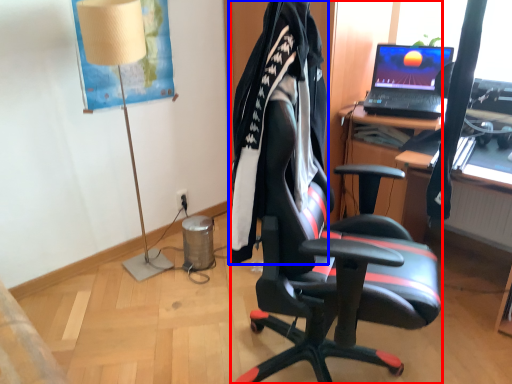
Question: Among these objects, which one is nearest to the camera, chair (highlighted by a red box) or clothing (highlighted by a blue box)?

Choices:
 (A) chair
 (B) clothing

Answer: (A)